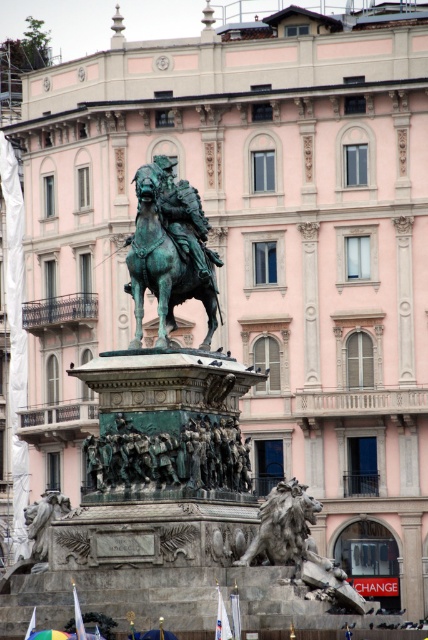
Question: Based on their relative distances, which object is farther from the bronze lion at lower left?

Choices:
 (A) white fabric flag at lower center
 (B) green patina statue at center
 (C) gray stone lion at center
 (D) white fabric flag at lower left

Answer: (A)

Question: Among these points, which one is farthest from the camera?

Choices:
 (A) (33, 624)
 (B) (226, 625)

Answer: (A)

Question: Does bronze statue at center have a larger size compared to gray stone lion at center?

Choices:
 (A) yes
 (B) no

Answer: (A)

Question: Is bronze statue at center thinner than green patina statue at center?

Choices:
 (A) yes
 (B) no

Answer: (B)

Question: Does bronze lion at lower left appear over white fabric flag at lower center?

Choices:
 (A) yes
 (B) no

Answer: (B)

Question: Which point is farther to the camera?

Choices:
 (A) bronze lion at lower left
 (B) green patina statue at center
 (C) white fabric flag at lower center
 (D) gray stone lion at center

Answer: (B)